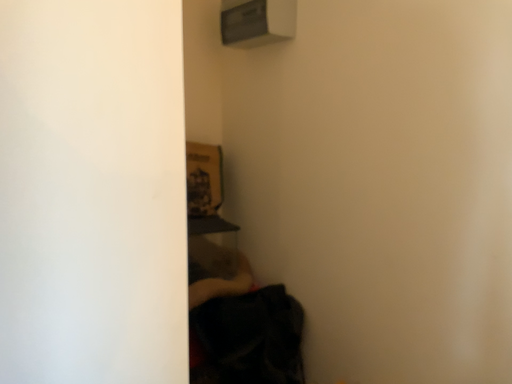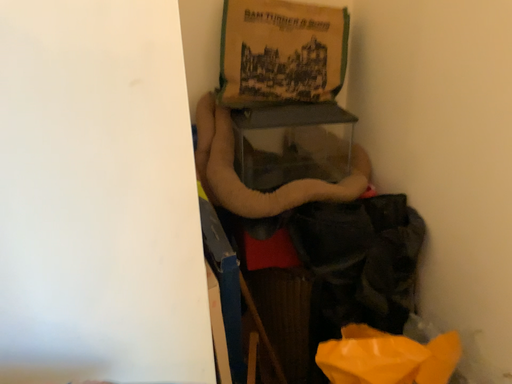
Question: Which way did the camera rotate in the video?

Choices:
 (A) rotated upward
 (B) rotated downward

Answer: (B)